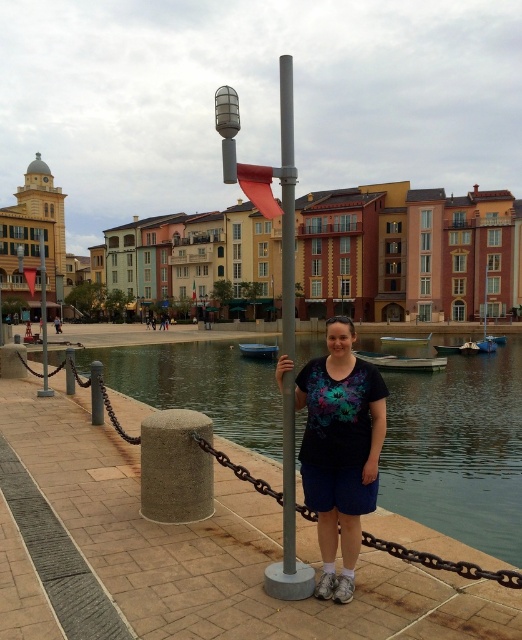
How distant is smooth concrete waterway at center from silver metallic pole at center?

smooth concrete waterway at center is 8.47 meters away from silver metallic pole at center.

Is point (396, 433) positioned behind point (283, 353)?

Yes, it is.

Identify the location of smooth concrete waterway at center. (458, 449).

Does smooth concrete waterway at center have a larger size compared to black matte t-shirt at center?

Yes, smooth concrete waterway at center is bigger than black matte t-shirt at center.

Can you confirm if smooth concrete waterway at center is positioned to the left of black matte t-shirt at center?

In fact, smooth concrete waterway at center is to the right of black matte t-shirt at center.

Image resolution: width=522 pixels, height=640 pixels. What do you see at coordinates (458, 449) in the screenshot?
I see `smooth concrete waterway at center` at bounding box center [458, 449].

At what (x,y) coordinates should I click in order to perform the action: click on smooth concrete waterway at center. Please return your answer as a coordinate pair (x, y). Looking at the image, I should click on (458, 449).

Can you confirm if metallic gray pole at center is bigger than silver metallic pole at center?

Yes.

Is metallic gray pole at center positioned in front of silver metallic pole at center?

Yes, metallic gray pole at center is closer to the viewer.

Locate an element on the screen. The image size is (522, 640). metallic gray pole at center is located at coordinates (266, 182).